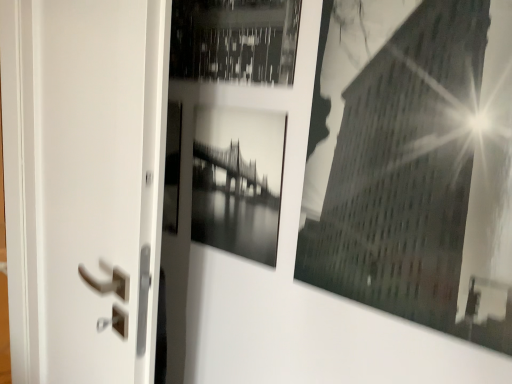
The width and height of the screenshot is (512, 384). What are the coordinates of `black glossy building at upper right, the 1th picture frame viewed from the right` in the screenshot? It's located at (414, 163).

The height and width of the screenshot is (384, 512). Describe the element at coordinates (238, 181) in the screenshot. I see `black glossy photo frame at center, arranged as the first picture frame when viewed from the left` at that location.

Find the location of a particular element. The image size is (512, 384). black glossy building at upper right, which ranks as the second picture frame in left-to-right order is located at coordinates (414, 163).

What's the angular difference between black glossy photo frame at center, which appears as the second picture frame when viewed from the right, and white matte screen door at left's facing directions?

There is a 10.5-degree angle between the facing directions of black glossy photo frame at center, which appears as the second picture frame when viewed from the right, and white matte screen door at left.

Considering the relative positions of black glossy photo frame at center, arranged as the first picture frame when viewed from the left, and white matte screen door at left in the image provided, is black glossy photo frame at center, arranged as the first picture frame when viewed from the left, in front of white matte screen door at left?

No, black glossy photo frame at center, arranged as the first picture frame when viewed from the left, is further to the viewer.

Considering the sizes of black glossy photo frame at center, arranged as the first picture frame when viewed from the left, and white matte screen door at left in the image, is black glossy photo frame at center, arranged as the first picture frame when viewed from the left, taller or shorter than white matte screen door at left?

In the image, black glossy photo frame at center, arranged as the first picture frame when viewed from the left, appears to be shorter than white matte screen door at left.

Considering the relative positions of black glossy photo frame at center, which appears as the second picture frame when viewed from the right, and white matte screen door at left in the image provided, is black glossy photo frame at center, which appears as the second picture frame when viewed from the right, to the left of white matte screen door at left from the viewer's perspective?

No.

Could you measure the distance between black glossy building at upper right, which ranks as the second picture frame in left-to-right order, and white matte screen door at left?

Result: black glossy building at upper right, which ranks as the second picture frame in left-to-right order, and white matte screen door at left are 19.41 inches apart from each other.

Is point (402, 182) closer to camera compared to point (39, 234)?

Yes, it is.

Is the surface of black glossy building at upper right, the 1th picture frame viewed from the right, in direct contact with white matte screen door at left?

No, black glossy building at upper right, the 1th picture frame viewed from the right, is not with white matte screen door at left.

Is black glossy building at upper right, which ranks as the second picture frame in left-to-right order, facing towards white matte screen door at left?

No.

From the picture: Is white matte screen door at left not near black glossy building at upper right, the 1th picture frame viewed from the right?

No.

Which point is more distant from viewer, (160, 149) or (453, 290)?

The point (160, 149) is farther.

Consider the image. Is black glossy building at upper right, the 1th picture frame viewed from the right, at the back of white matte screen door at left?

That's not correct — white matte screen door at left is not looking away from black glossy building at upper right, the 1th picture frame viewed from the right.

Find the location of `the 2nd picture frame to the right when counting from the white matte screen door at left`. the 2nd picture frame to the right when counting from the white matte screen door at left is located at coordinates (414, 163).

Considering the relative sizes of black glossy building at upper right, which ranks as the second picture frame in left-to-right order, and black glossy photo frame at center, arranged as the first picture frame when viewed from the left, in the image provided, is black glossy building at upper right, which ranks as the second picture frame in left-to-right order, bigger than black glossy photo frame at center, arranged as the first picture frame when viewed from the left,?

Correct, black glossy building at upper right, which ranks as the second picture frame in left-to-right order, is larger in size than black glossy photo frame at center, arranged as the first picture frame when viewed from the left.

From the image's perspective, between black glossy building at upper right, which ranks as the second picture frame in left-to-right order, and black glossy photo frame at center, arranged as the first picture frame when viewed from the left, which one is located above?

From the image's view, black glossy building at upper right, which ranks as the second picture frame in left-to-right order, is above.

Is point (437, 10) farther from viewer compared to point (244, 125)?

No.

Which is more to the right, black glossy building at upper right, which ranks as the second picture frame in left-to-right order, or black glossy photo frame at center, which appears as the second picture frame when viewed from the right?

black glossy building at upper right, which ranks as the second picture frame in left-to-right order.

Looking at their sizes, would you say black glossy photo frame at center, which appears as the second picture frame when viewed from the right, is wider or thinner than black glossy building at upper right, which ranks as the second picture frame in left-to-right order?

In the image, black glossy photo frame at center, which appears as the second picture frame when viewed from the right, appears to be more narrow than black glossy building at upper right, which ranks as the second picture frame in left-to-right order.

Between black glossy photo frame at center, arranged as the first picture frame when viewed from the left, and black glossy building at upper right, the 1th picture frame viewed from the right, which one appears on the right side from the viewer's perspective?

Positioned to the right is black glossy building at upper right, the 1th picture frame viewed from the right.

What are the coordinates of `picture frame above the black glossy photo frame at center, which appears as the second picture frame when viewed from the right (from the image's perspective)` in the screenshot? It's located at (414, 163).

Starting from the white matte screen door at left, which picture frame is the 1st one to the right? Please provide its 2D coordinates.

[(238, 181)]

In the scene shown: Does white matte screen door at left appear on the left side of black glossy photo frame at center, arranged as the first picture frame when viewed from the left?

Yes.

Consider the image. Between white matte screen door at left and black glossy photo frame at center, arranged as the first picture frame when viewed from the left, which one has larger width?

With larger width is white matte screen door at left.

Is white matte screen door at left directly adjacent to black glossy photo frame at center, which appears as the second picture frame when viewed from the right?

No, white matte screen door at left is not touching black glossy photo frame at center, which appears as the second picture frame when viewed from the right.

Locate an element on the screen. This screenshot has height=384, width=512. picture frame behind the white matte screen door at left is located at coordinates (238, 181).

This screenshot has width=512, height=384. I want to click on screen door beneath the black glossy building at upper right, the 1th picture frame viewed from the right (from a real-world perspective), so click(x=99, y=185).

When comparing their distances from black glossy photo frame at center, arranged as the first picture frame when viewed from the left, does white matte screen door at left or black glossy building at upper right, the 1th picture frame viewed from the right, seem closer?

black glossy building at upper right, the 1th picture frame viewed from the right, is closer to black glossy photo frame at center, arranged as the first picture frame when viewed from the left.

Which object lies further to the anchor point black glossy building at upper right, which ranks as the second picture frame in left-to-right order, black glossy photo frame at center, which appears as the second picture frame when viewed from the right, or white matte screen door at left?

white matte screen door at left is further to black glossy building at upper right, which ranks as the second picture frame in left-to-right order.

Estimate the real-world distances between objects in this image. Which object is closer to black glossy photo frame at center, which appears as the second picture frame when viewed from the right, black glossy building at upper right, which ranks as the second picture frame in left-to-right order, or white matte screen door at left?

black glossy building at upper right, which ranks as the second picture frame in left-to-right order.

Looking at the image, which one is located closer to white matte screen door at left, black glossy building at upper right, the 1th picture frame viewed from the right, or black glossy photo frame at center, arranged as the first picture frame when viewed from the left?

black glossy photo frame at center, arranged as the first picture frame when viewed from the left, lies closer to white matte screen door at left than the other object.

Considering their positions, is black glossy photo frame at center, which appears as the second picture frame when viewed from the right, positioned closer to white matte screen door at left than black glossy building at upper right, the 1th picture frame viewed from the right?

black glossy photo frame at center, which appears as the second picture frame when viewed from the right, lies closer to white matte screen door at left than the other object.

Estimate the real-world distances between objects in this image. Which object is closer to black glossy building at upper right, which ranks as the second picture frame in left-to-right order, white matte screen door at left or black glossy photo frame at center, arranged as the first picture frame when viewed from the left?

black glossy photo frame at center, arranged as the first picture frame when viewed from the left.

Locate an element on the screen. picture frame between white matte screen door at left and black glossy building at upper right, which ranks as the second picture frame in left-to-right order, in the horizontal direction is located at coordinates (238, 181).